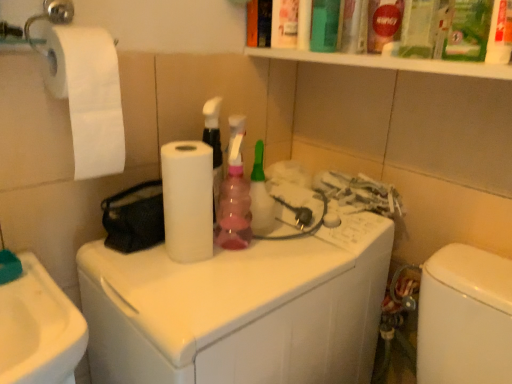
Describe the element at coordinates (188, 200) in the screenshot. The width and height of the screenshot is (512, 384). I see `white matte paper towel at center` at that location.

What do you see at coordinates (89, 97) in the screenshot?
I see `white matte toilet paper at left` at bounding box center [89, 97].

Image resolution: width=512 pixels, height=384 pixels. I want to click on white glossy washing machine at center, so click(x=240, y=309).

Is white matte toilet paper at left facing towards white glossy washing machine at center?

No.

Measure the distance between white matte toilet paper at left and white glossy washing machine at center.

white matte toilet paper at left is 15.78 inches away from white glossy washing machine at center.

Which is nearer, [112,142] or [127,268]?

Positioned in front is point [112,142].

From the image's perspective, which is below, white matte toilet paper at left or white glossy washing machine at center?

white glossy washing machine at center appears lower in the image.

Looking at their sizes, would you say pink plastic spray bottle at center is wider or thinner than white glossy washing machine at center?

Clearly, pink plastic spray bottle at center has less width compared to white glossy washing machine at center.

In the scene shown: Is pink plastic spray bottle at center in front of or behind white glossy washing machine at center in the image?

Clearly, pink plastic spray bottle at center is behind white glossy washing machine at center.

Is pink plastic spray bottle at center not near white glossy washing machine at center?

pink plastic spray bottle at center is actually quite close to white glossy washing machine at center.

Does white matte paper towel at center come in front of white glossy washing machine at center?

No, white matte paper towel at center is further to the viewer.

From a real-world perspective, between white matte paper towel at center and white glossy washing machine at center, who is vertically higher?

white matte paper towel at center, from a real-world perspective.

Between white matte paper towel at center and white glossy washing machine at center, which one has smaller width?

Thinner between the two is white matte paper towel at center.

Is point (333, 373) closer or farther from the camera than point (209, 244)?

Point (333, 373) appears to be farther away from the viewer than point (209, 244).

Is white glossy washing machine at center in front of or behind white matte paper towel at center in the image?

In the image, white glossy washing machine at center appears in front of white matte paper towel at center.

Can you see white glossy washing machine at center touching white matte paper towel at center?

There is a gap between white glossy washing machine at center and white matte paper towel at center.

In the scene shown: Considering the relative positions of white glossy washing machine at center and white matte paper towel at center in the image provided, is white glossy washing machine at center to the right of white matte paper towel at center from the viewer's perspective?

Yes, white glossy washing machine at center is to the right of white matte paper towel at center.

From a real-world perspective, which is physically below, white glossy washing machine at center or pink plastic spray bottle at center?

white glossy washing machine at center.

Could you tell me if white glossy washing machine at center is turned towards pink plastic spray bottle at center?

No, white glossy washing machine at center is not aimed at pink plastic spray bottle at center.

Considering the sizes of objects white glossy washing machine at center and pink plastic spray bottle at center in the image provided, who is bigger, white glossy washing machine at center or pink plastic spray bottle at center?

With larger size is white glossy washing machine at center.

Is white matte toilet paper at left oriented away from white matte paper towel at center?

No, white matte toilet paper at left is not facing the opposite direction of white matte paper towel at center.

From the image's perspective, is white matte toilet paper at left above or below white matte paper towel at center?

Based on their image positions, white matte toilet paper at left is located above white matte paper towel at center.

From a real-world perspective, between white matte toilet paper at left and white matte paper towel at center, who is vertically higher?

In real-world perspective, white matte toilet paper at left is above.

Is white matte toilet paper at left further to camera compared to white matte paper towel at center?

No.

Is pink plastic spray bottle at center with white matte paper towel at center?

pink plastic spray bottle at center is not next to white matte paper towel at center, and they're not touching.

From a real-world perspective, relative to white matte paper towel at center, is pink plastic spray bottle at center vertically above or below?

In terms of real-world spatial position, pink plastic spray bottle at center is above white matte paper towel at center.

From the image's perspective, which is below, pink plastic spray bottle at center or white matte paper towel at center?

white matte paper towel at center, from the image's perspective.

Is pink plastic spray bottle at center located outside white matte paper towel at center?

Indeed, pink plastic spray bottle at center is completely outside white matte paper towel at center.

The height and width of the screenshot is (384, 512). I want to click on washing machine lying below the white matte toilet paper at left (from the image's perspective), so click(240, 309).

Locate an element on the screen. This screenshot has width=512, height=384. cleaning product above the white glossy washing machine at center (from the image's perspective) is located at coordinates (234, 195).

Looking at the image, which one is located closer to pink plastic spray bottle at center, white glossy washing machine at center or white matte toilet paper at left?

Among the two, white glossy washing machine at center is located nearer to pink plastic spray bottle at center.

Estimate the real-world distances between objects in this image. Which object is further from pink plastic spray bottle at center, white glossy washing machine at center or white matte paper towel at center?

The object further to pink plastic spray bottle at center is white glossy washing machine at center.

Considering their positions, is white matte toilet paper at left positioned closer to white matte paper towel at center than white glossy washing machine at center?

The object closer to white matte paper towel at center is white matte toilet paper at left.

Which object lies nearer to the anchor point white matte toilet paper at left, pink plastic spray bottle at center or white glossy washing machine at center?

The object closer to white matte toilet paper at left is pink plastic spray bottle at center.

Based on their spatial positions, is white matte paper towel at center or pink plastic spray bottle at center further from white glossy washing machine at center?

pink plastic spray bottle at center lies further to white glossy washing machine at center than the other object.

Looking at this image, based on their spatial positions, is white matte toilet paper at left or white matte paper towel at center closer to white glossy washing machine at center?

The object closer to white glossy washing machine at center is white matte paper towel at center.

Considering their positions, is white glossy washing machine at center positioned closer to white matte paper towel at center than pink plastic spray bottle at center?

The object closer to white matte paper towel at center is pink plastic spray bottle at center.

From the image, which object appears to be farther from pink plastic spray bottle at center, white matte toilet paper at left or white matte paper towel at center?

white matte toilet paper at left is further to pink plastic spray bottle at center.

Locate an element on the screen. paper towel between pink plastic spray bottle at center and white glossy washing machine at center in the vertical direction is located at coordinates (188, 200).

At what (x,y) coordinates should I click in order to perform the action: click on cleaning product between white matte toilet paper at left and white glossy washing machine at center in the up-down direction. Please return your answer as a coordinate pair (x, y). The image size is (512, 384). Looking at the image, I should click on (234, 195).

Image resolution: width=512 pixels, height=384 pixels. What are the coordinates of `paper towel between white matte toilet paper at left and pink plastic spray bottle at center from front to back` in the screenshot? It's located at (188, 200).

Locate an element on the screen. Image resolution: width=512 pixels, height=384 pixels. paper towel between white matte toilet paper at left and white glossy washing machine at center from top to bottom is located at coordinates (188, 200).